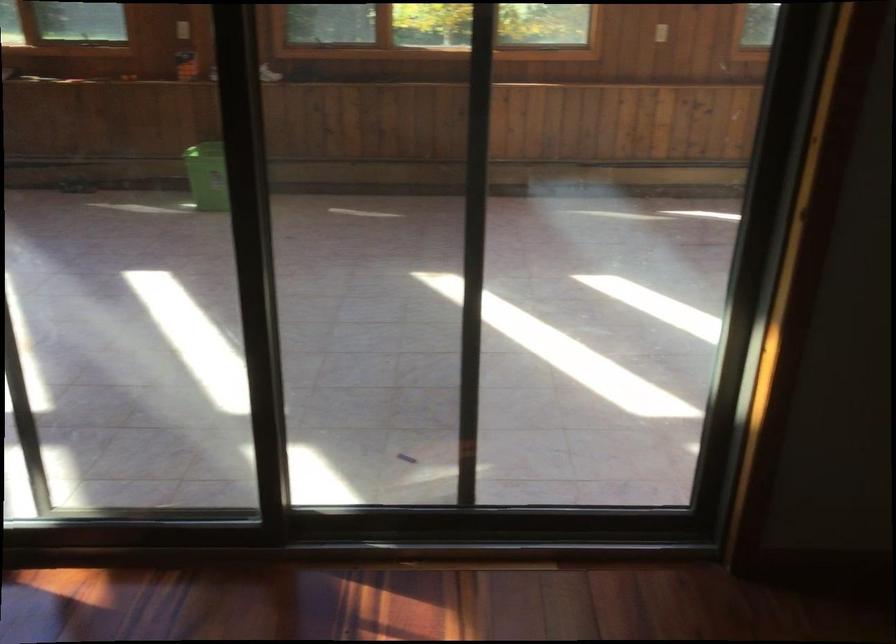
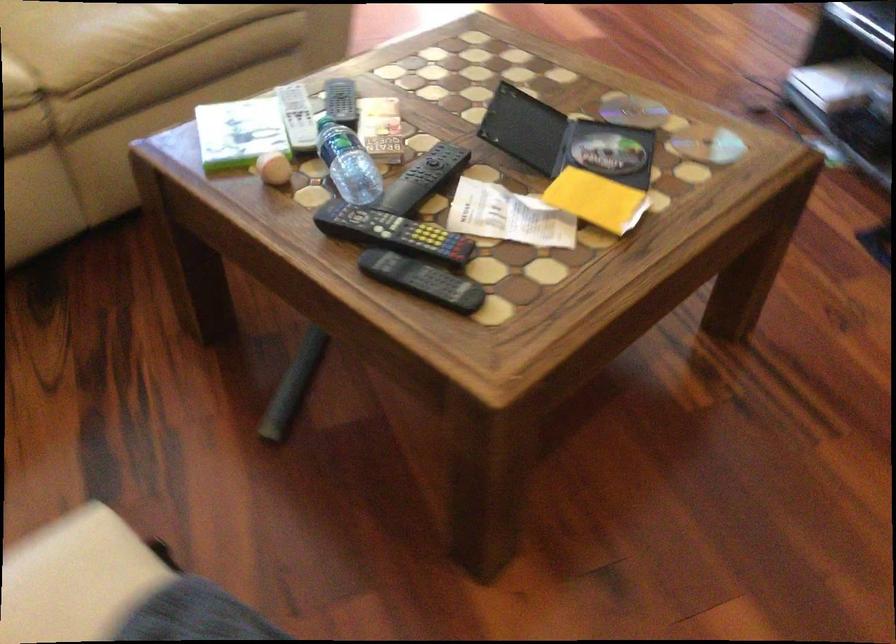
The images are taken continuously from a first-person perspective. In which direction are you moving?

The cameraman moved toward left, backward.